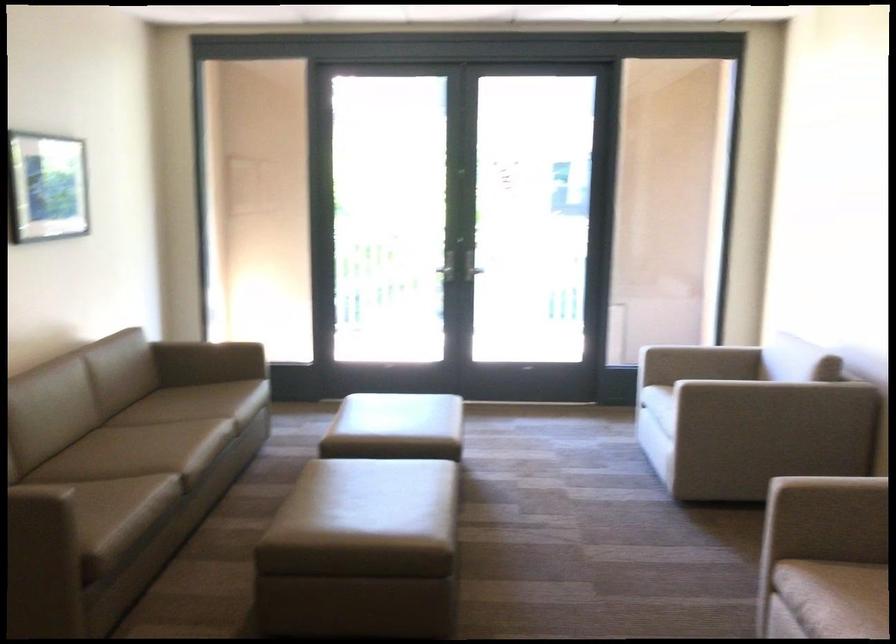
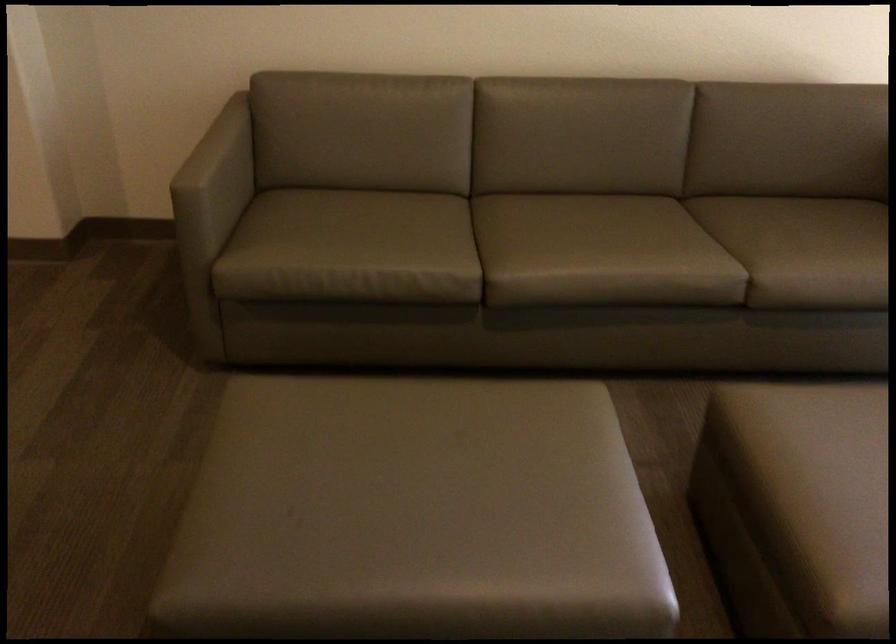
Where in the second image is the point corresponding to (x=82, y=507) from the first image?

(346, 242)